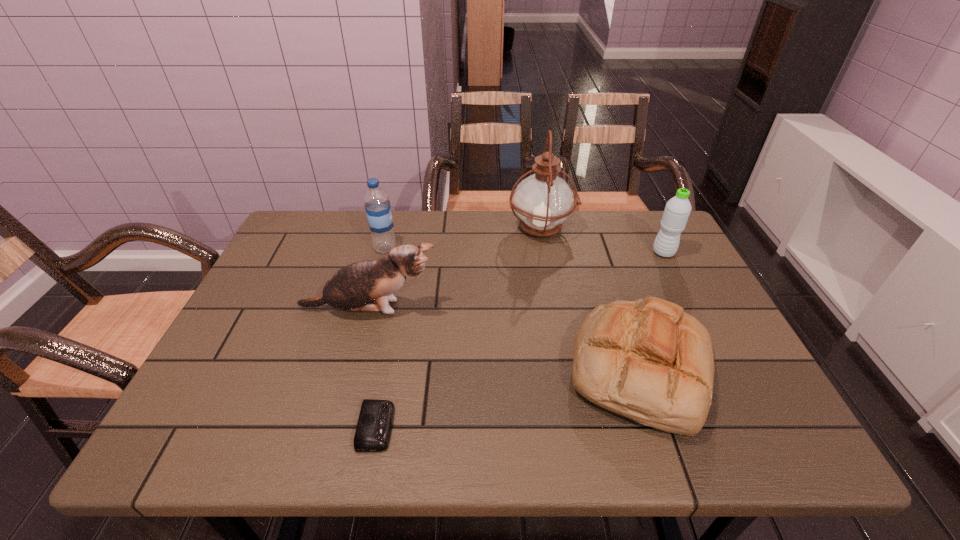
Find the location of a particular element. blank area at the far edge is located at coordinates (x=514, y=244).

In the image, there is a desktop. Where is `vacant space at the near edge`? The height and width of the screenshot is (540, 960). vacant space at the near edge is located at coordinates (399, 426).

I want to click on vacant space at the left edge of the desktop, so click(x=325, y=256).

At what (x,y) coordinates should I click in order to perform the action: click on vacant space at the right edge of the desktop. Please return your answer as a coordinate pair (x, y). The image size is (960, 540). Looking at the image, I should click on (683, 301).

Find the location of a particular element. vacant space at the far left corner of the desktop is located at coordinates (296, 252).

Find the location of a particular element. blank space at the near left corner is located at coordinates (194, 416).

Locate an element on the screen. free point at the near right corner is located at coordinates (797, 447).

This screenshot has height=540, width=960. Identify the location of free space between the fifth tallest object and the left water bottle. (513, 308).

In order to click on free area in between the left water bottle and the right water bottle in this screenshot , I will do `click(524, 251)`.

The image size is (960, 540). In order to click on vacant area that lies between the cat and the oil lamp in this screenshot , I will do `click(455, 268)`.